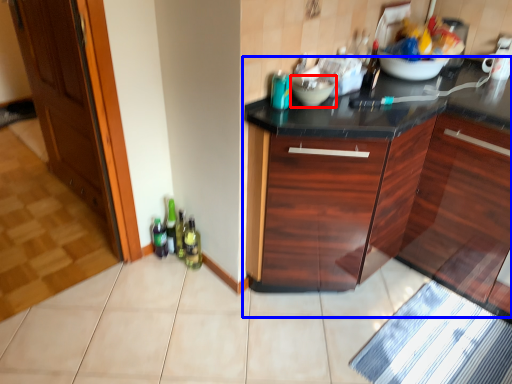
Question: Which object appears farthest to the camera in this image, mixing bowl (highlighted by a red box) or cabinetry (highlighted by a blue box)?

Choices:
 (A) mixing bowl
 (B) cabinetry

Answer: (A)